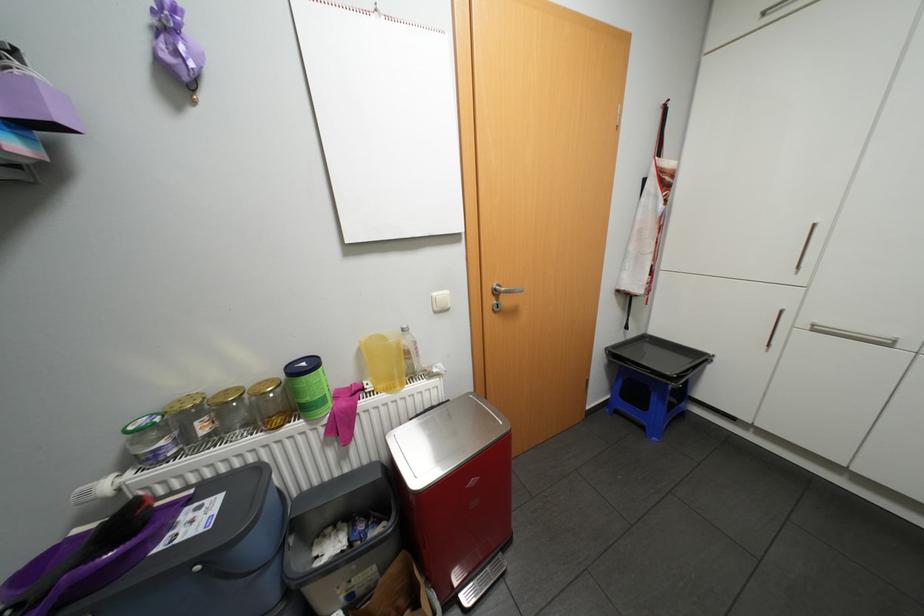
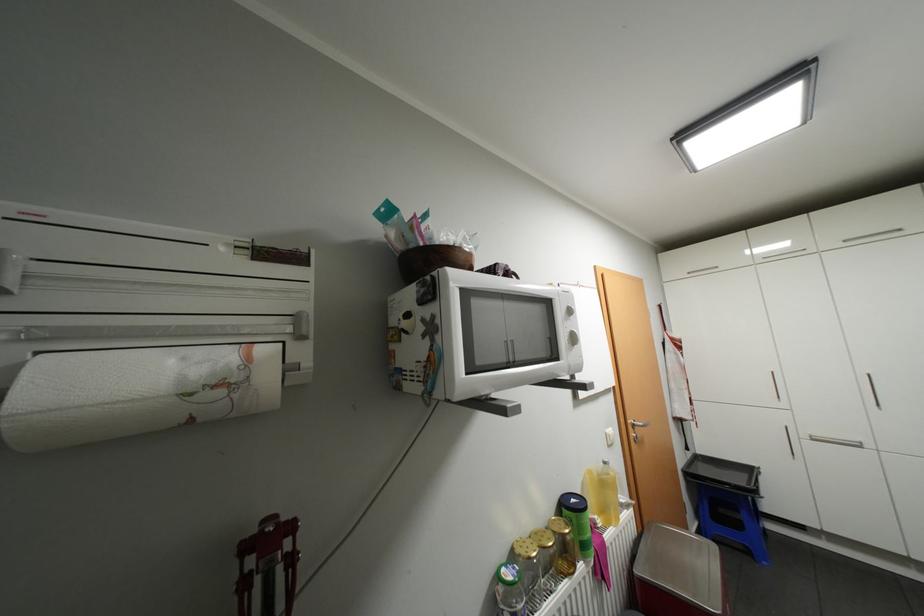
Find the pixel in the second image that matches point (650, 427) in the first image.

(756, 552)